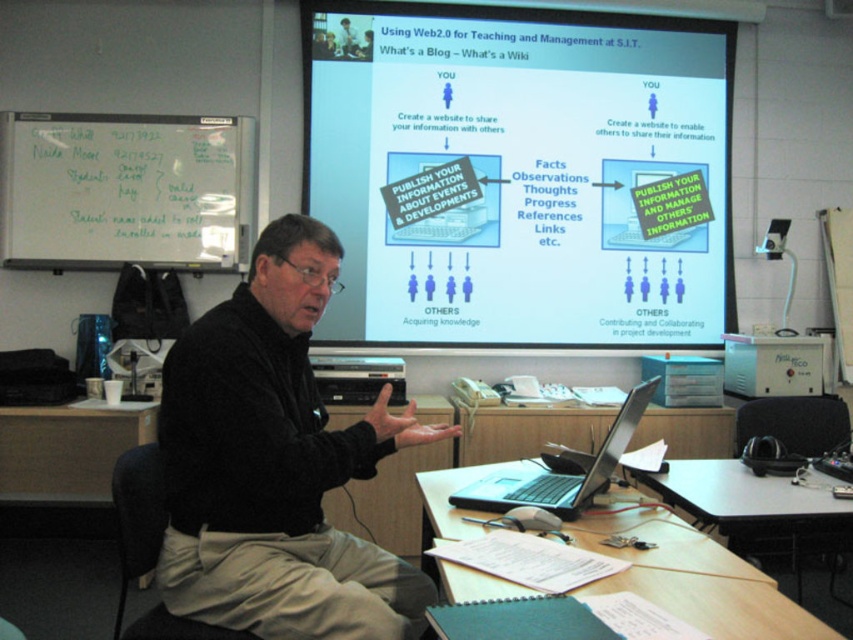
You are standing at the front of the classroom facing the projection screen. You need to locate two points on the screen. The first point is at coordinates point(207, 163) and the second is at point(109, 412). Which point is closer to the bottom edge of the screen?

Point(109, 412) is closer to the bottom edge of the screen because its y coordinate is 0.129, which is lower than the y coordinate of point(207, 163) which is 0.245.

You are a student sitting in the classroom and want to ask the presenter a question. You notice the black sweater at center and the wooden desk at lower left. Which object is located to the right of the other?

The black sweater at center is positioned on the right side of wooden desk at lower left.